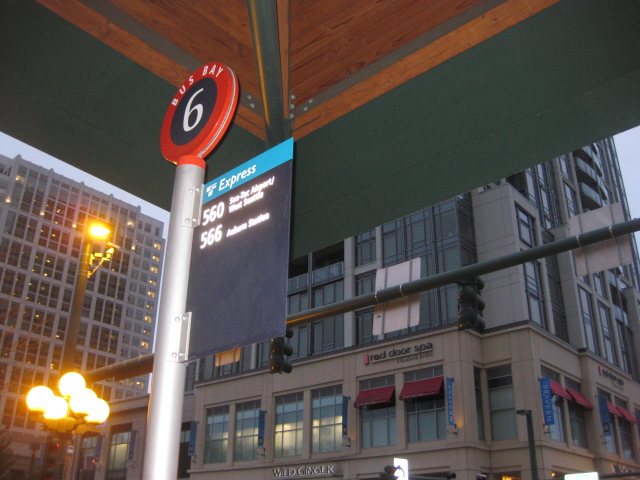
The height and width of the screenshot is (480, 640). What are the coordinates of `light` in the screenshot? It's located at (100, 224).